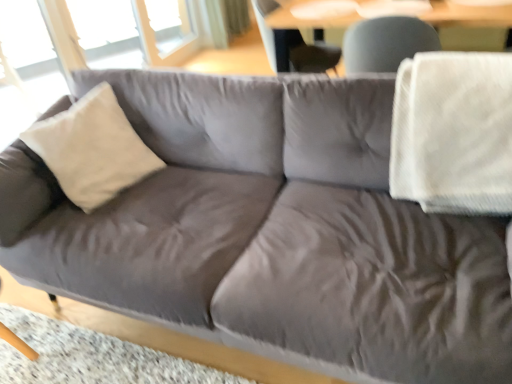
Question: From a real-world perspective, is matte gray swivel chair at upper center under transparent glass window at upper left?

Choices:
 (A) no
 (B) yes

Answer: (A)

Question: Can you confirm if matte gray swivel chair at upper center is taller than transparent glass window at upper left?

Choices:
 (A) yes
 (B) no

Answer: (B)

Question: Is transparent glass window at upper left surrounded by matte gray swivel chair at upper center?

Choices:
 (A) yes
 (B) no

Answer: (B)

Question: Does matte gray swivel chair at upper center have a lesser height compared to transparent glass window at upper left?

Choices:
 (A) no
 (B) yes

Answer: (B)

Question: From a real-world perspective, is matte gray swivel chair at upper center positioned over transparent glass window at upper left based on gravity?

Choices:
 (A) yes
 (B) no

Answer: (A)

Question: Is point (432, 130) positioned closer to the camera than point (261, 33)?

Choices:
 (A) farther
 (B) closer

Answer: (B)

Question: From the image's perspective, is white textured blanket at right located above or below matte gray swivel chair at upper center?

Choices:
 (A) below
 (B) above

Answer: (A)

Question: From a real-world perspective, relative to matte gray swivel chair at upper center, is white textured blanket at right vertically above or below?

Choices:
 (A) above
 (B) below

Answer: (A)

Question: Choose the correct answer: Is white textured blanket at right inside matte gray swivel chair at upper center or outside it?

Choices:
 (A) inside
 (B) outside

Answer: (B)

Question: Is matte gray swivel chair at upper center inside or outside of white textured blanket at right?

Choices:
 (A) outside
 (B) inside

Answer: (A)

Question: From a real-world perspective, is matte gray swivel chair at upper center physically located above or below white textured blanket at right?

Choices:
 (A) above
 (B) below

Answer: (B)

Question: In terms of height, does matte gray swivel chair at upper center look taller or shorter compared to white textured blanket at right?

Choices:
 (A) short
 (B) tall

Answer: (B)

Question: In terms of width, does matte gray swivel chair at upper center look wider or thinner when compared to white textured blanket at right?

Choices:
 (A) thin
 (B) wide

Answer: (B)

Question: Visually, is white textured blanket at right positioned to the left or to the right of transparent glass window at upper left?

Choices:
 (A) right
 (B) left

Answer: (A)

Question: Looking at their shapes, would you say white textured blanket at right is wider or thinner than transparent glass window at upper left?

Choices:
 (A) wide
 (B) thin

Answer: (A)